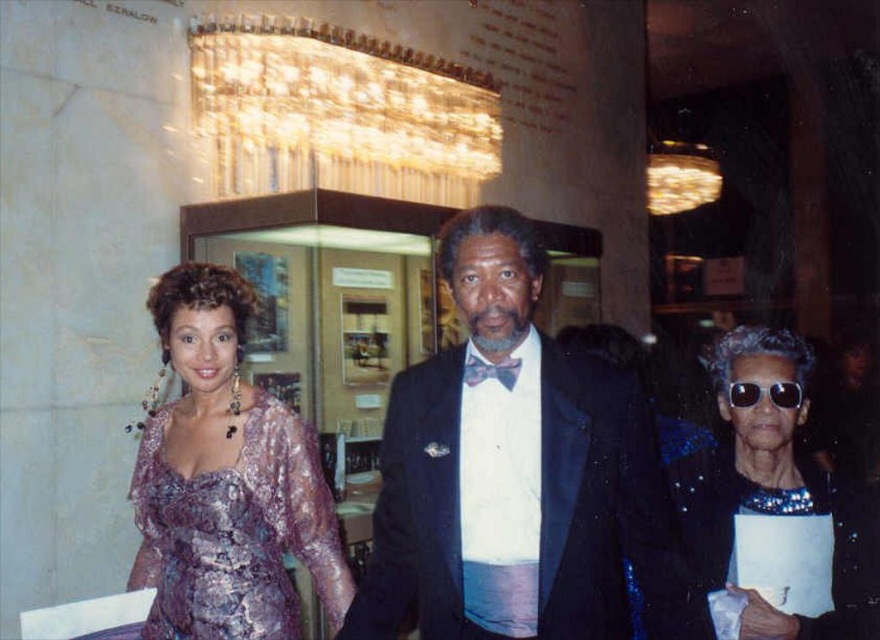
You are a photographer positioned in front of the shiny black suit at center and the black reflective sunglasses at center. You need to adjust your camera to focus on both objects simultaneously. Given that your camera has a depth of field that can cover 27 inches, will both objects be in focus?

The distance between the shiny black suit at center and the black reflective sunglasses at center is 26.88 inches, which is within the camera lens depth of field of 27 inches. Therefore, both objects will be in focus.

You are a photographer at the event and need to capture a clear photo of both the shiny purple dress at left and the metallic purple dress at left. Since they are both on the left side, which one is closer to the camera?

The shiny purple dress at left is in front of the metallic purple dress at left, so it is closer to the camera.